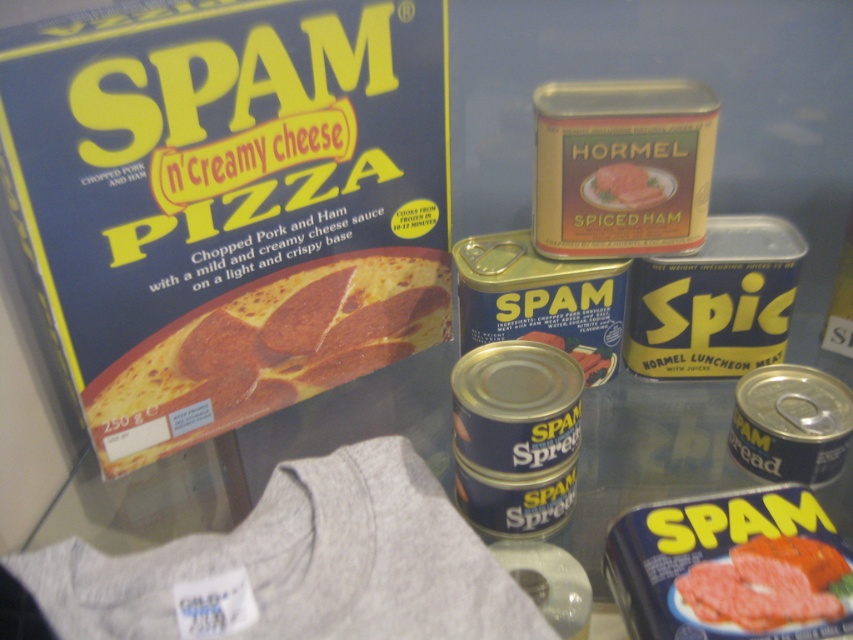
Is smooth pink ham at center to the right of spiced ham at center from the viewer's perspective?

Correct, you'll find smooth pink ham at center to the right of spiced ham at center.

Is point (779, 540) positioned behind point (601, 186)?

No, it is in front of (601, 186).

Where is `smooth pink ham at center`? This screenshot has height=640, width=853. smooth pink ham at center is located at coordinates (767, 582).

Who is lower down, yellow matte pizza at upper left or smooth pink ham at center?

smooth pink ham at center is below.

Looking at this image, is yellow matte pizza at upper left to the right of smooth pink ham at center from the viewer's perspective?

In fact, yellow matte pizza at upper left is to the left of smooth pink ham at center.

Locate an element on the screen. yellow matte pizza at upper left is located at coordinates (268, 349).

Find the location of `yellow matte pizza at upper left`. yellow matte pizza at upper left is located at coordinates (268, 349).

Looking at this image, is yellow matte pizza at upper left positioned before spiced ham at center?

Yes, yellow matte pizza at upper left is in front of spiced ham at center.

Which is below, yellow matte pizza at upper left or spiced ham at center?

yellow matte pizza at upper left

Between point (236, 356) and point (593, 177), which one is positioned in front?

Point (593, 177) is in front.

At what (x,y) coordinates should I click in order to perform the action: click on yellow matte pizza at upper left. Please return your answer as a coordinate pair (x, y). This screenshot has width=853, height=640. Looking at the image, I should click on (268, 349).